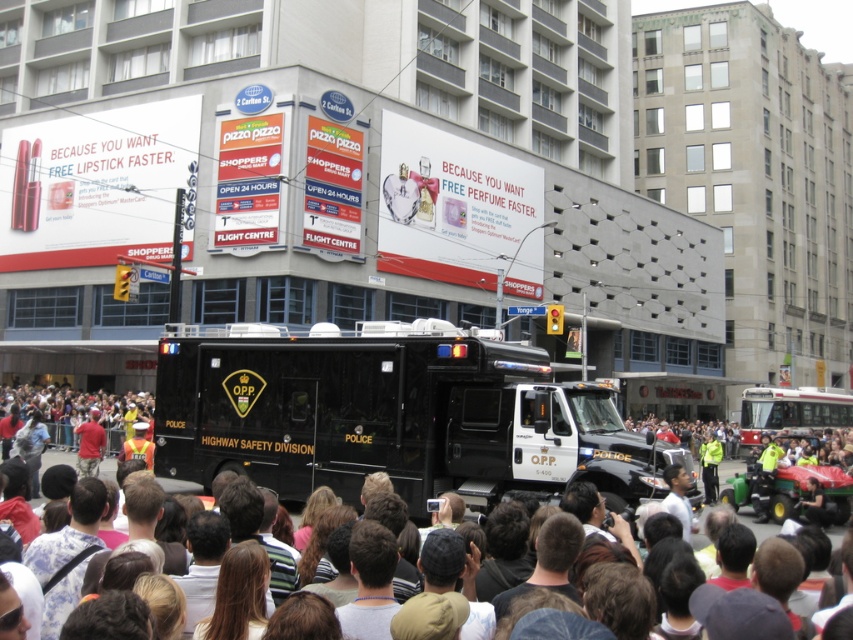
Is black matte truck at center shorter than red shirt at center?

In fact, black matte truck at center may be taller than red shirt at center.

Is point (242, 353) less distant than point (80, 458)?

Yes, point (242, 353) is closer to viewer.

Does point (410, 396) lie in front of point (105, 436)?

Yes, it is.

At what (x,y) coordinates should I click in order to perform the action: click on black matte truck at center. Please return your answer as a coordinate pair (x, y). The width and height of the screenshot is (853, 640). Looking at the image, I should click on (389, 413).

Is black matte truck at center to the left of dark brown hair at center from the viewer's perspective?

Indeed, black matte truck at center is positioned on the left side of dark brown hair at center.

Can you confirm if black matte truck at center is positioned to the right of dark brown hair at center?

Incorrect, black matte truck at center is not on the right side of dark brown hair at center.

Identify the location of black matte truck at center. The width and height of the screenshot is (853, 640). (389, 413).

Is dark brown hair at center shorter than yellow reflective vest at center?

No, dark brown hair at center is not shorter than yellow reflective vest at center.

Is point (173, 481) positioned before point (712, 449)?

That is True.

In order to click on dark brown hair at center in this screenshot , I will do `click(62, 400)`.